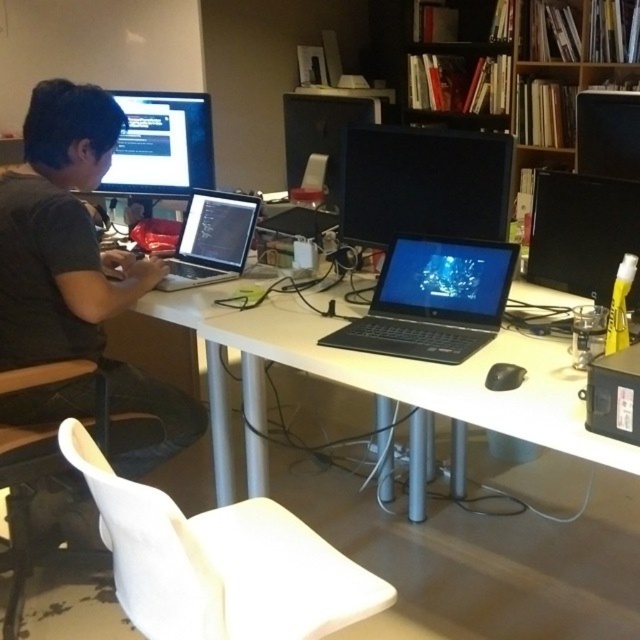
You are standing in the home office and want to place a new keyboard between the black matte laptop at left and the white plastic chair at lower left. Can you fit it there?

The black matte laptop at left is positioned on the left side of the white plastic chair at lower left, so there is space between them to place the keyboard.

You are a delivery person who needs to place a package on the desk. The package is 20 cm wide. The black matte laptop at center and the silver metallic laptop at center are both on the desk. Can you fit the package between them?

The black matte laptop at center is closer to the viewer than the silver metallic laptop at center, so the distance between them isn

You are planning to place a new keyboard on the desk. The keyboard requires a minimum of 50 cm of space. Given the white plastic desk at center and the black glossy monitor at center, can you determine if there is enough space on the desk to accommodate the keyboard?

The white plastic desk at center has a larger width than the black glossy monitor at center. Since the desk is wider, there should be sufficient space to place the keyboard as long as other items on the desk do not occupy the required 50 cm. However, the exact available space isn answer the description provided.